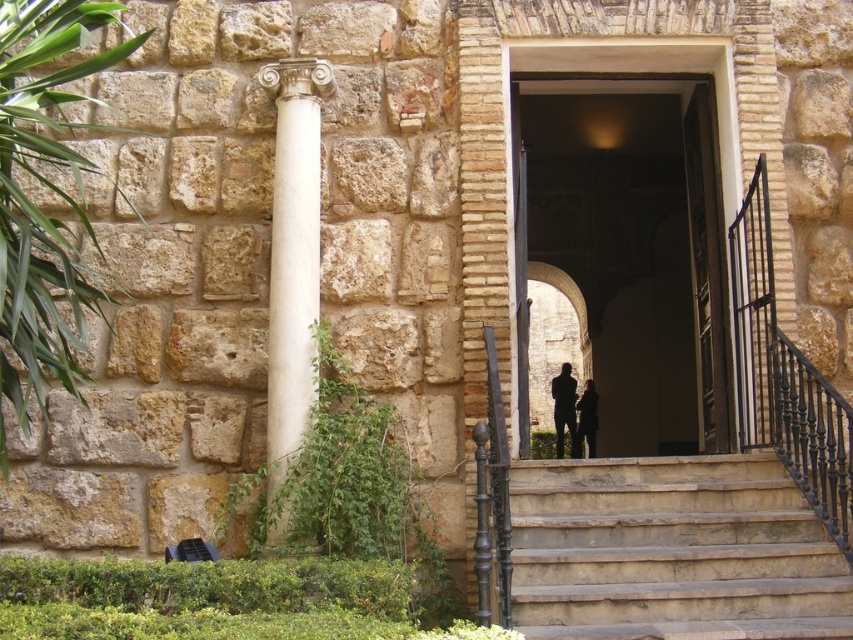
Does dark gray suit at center lie in front of dark fabric figure at center?

No.

In the scene shown: Who is positioned more to the left, dark gray suit at center or dark fabric figure at center?

Positioned to the left is dark gray suit at center.

Who is more forward, [556,387] or [576,403]?

Positioned in front is point [576,403].

Find the location of `dark gray suit at center`. dark gray suit at center is located at coordinates pyautogui.click(x=566, y=410).

Who is higher up, smooth stone archway at center or dark fabric figure at center?

Positioned higher is smooth stone archway at center.

Is point (693, 300) farther from camera compared to point (596, 403)?

No, it is not.

You are a GUI agent. You are given a task and a screenshot of the screen. Output one action in this format:
    pyautogui.click(x=<x>, y=<y>)
    Task: Click on the smooth stone archway at center
    The image size is (853, 640).
    Given the screenshot: What is the action you would take?
    pyautogui.click(x=637, y=253)

Between brown stone stairs at center and dark gray suit at center, which one has less height?

Standing shorter between the two is brown stone stairs at center.

Who is lower down, brown stone stairs at center or dark gray suit at center?

brown stone stairs at center is below.

Who is more distant from viewer, (670, 532) or (579, 444)?

Positioned behind is point (579, 444).

Identify the location of brown stone stairs at center. The image size is (853, 640). (672, 552).